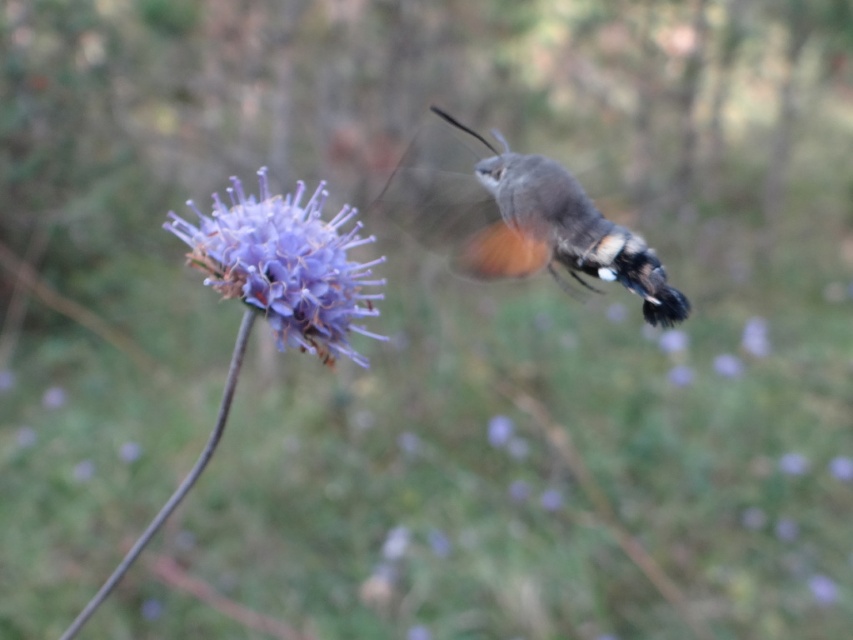
You are a photographer trying to capture the gray matte moth at upper right and the purple fluffy flower at center in focus simultaneously. Based on their positions, which one will be in focus if you focus on the closer object?

The gray matte moth at upper right is closer to you than the purple fluffy flower at center, so focusing on the closer object will keep the gray matte moth at upper right in focus while the purple fluffy flower at center may appear out of focus.

In the scene shown: You are standing in a garden and see the gray matte moth at upper right. If you want to observe it closely without disturbing it, what is the minimum distance you should maintain?

The gray matte moth at upper right is 1.65 meters away from the viewer, so you should maintain a distance of at least 1.65 meters to observe it closely without disturbing it.